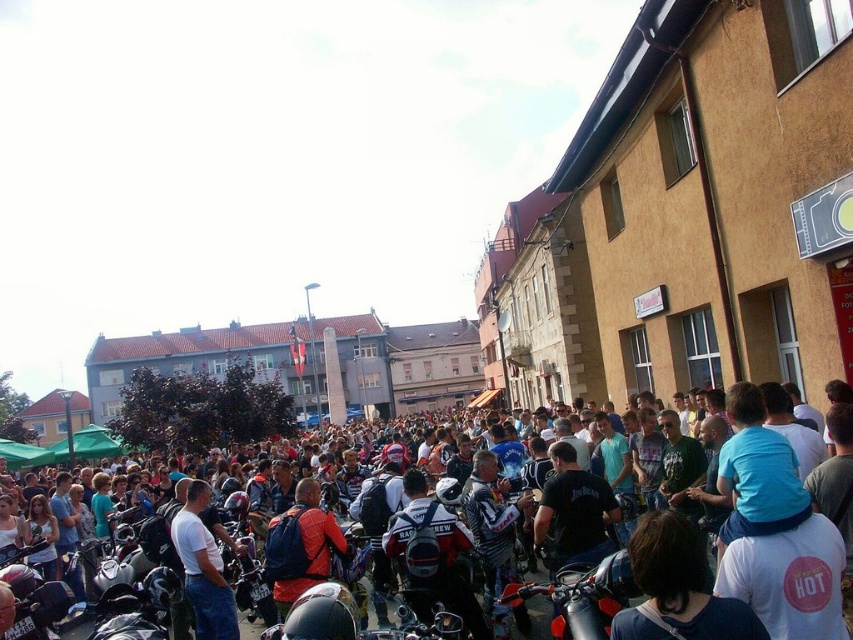
Consider the image. You are a photographer trying to capture the crowd in the town square. You notice a dark blue leather jackets at center located at point [727,580]. Can you estimate how many people are wearing dark blue leather jackets at center in the crowd?

The question cannot be answered with the provided information as the number of people wearing dark blue leather jackets at center is not specified in the scene description or object details.

You are a photographer at the event and want to capture both the dark blue leather jackets at center and the red and white motorcycle at center in a single frame. Which object should you focus on first to ensure both are in the shot?

The dark blue leather jackets at center is positioned over the red and white motorcycle at center, so you should focus on the motorcycle first to ensure both are in the shot.